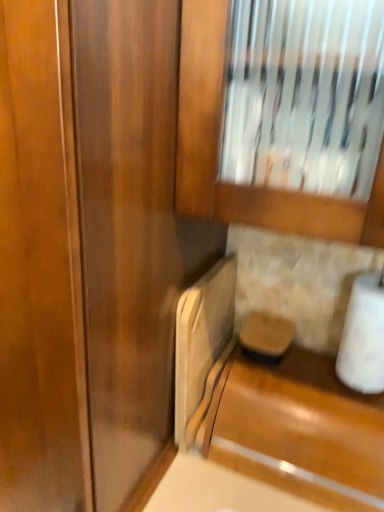
What do you see at coordinates (299, 430) in the screenshot? I see `glossy wood cabinet at lower right` at bounding box center [299, 430].

Find the location of a particular element. Image resolution: width=384 pixels, height=512 pixels. glossy wood cabinet at lower right is located at coordinates (299, 430).

In order to face white matte toilet paper at lower right, should I rotate leftwards or rightwards?

To align with it, rotate right about 22.948°.

This screenshot has height=512, width=384. What do you see at coordinates (363, 336) in the screenshot?
I see `white matte toilet paper at lower right` at bounding box center [363, 336].

The image size is (384, 512). In order to click on white matte toilet paper at lower right in this screenshot , I will do `click(363, 336)`.

Where is `glossy wood cabinet at lower right`? This screenshot has height=512, width=384. glossy wood cabinet at lower right is located at coordinates (299, 430).

Is glossy wood cabinet at lower right to the right of white matte toilet paper at lower right from the viewer's perspective?

No.

Is the depth of glossy wood cabinet at lower right greater than that of white matte toilet paper at lower right?

No, glossy wood cabinet at lower right is closer to the camera.

Considering the points (318, 444) and (364, 321), which point is in front, point (318, 444) or point (364, 321)?

Point (364, 321)

From the image's perspective, between glossy wood cabinet at lower right and white matte toilet paper at lower right, who is located below?

glossy wood cabinet at lower right is shown below in the image.

From a real-world perspective, relative to white matte toilet paper at lower right, is glossy wood cabinet at lower right vertically above or below?

glossy wood cabinet at lower right is situated lower than white matte toilet paper at lower right in the real world.

Is glossy wood cabinet at lower right wider than white matte toilet paper at lower right?

Correct, the width of glossy wood cabinet at lower right exceeds that of white matte toilet paper at lower right.

Between glossy wood cabinet at lower right and white matte toilet paper at lower right, which one has less height?

glossy wood cabinet at lower right is shorter.

Which of these two, glossy wood cabinet at lower right or white matte toilet paper at lower right, is bigger?

Bigger between the two is glossy wood cabinet at lower right.

Which is correct: glossy wood cabinet at lower right is inside white matte toilet paper at lower right, or outside of it?

glossy wood cabinet at lower right is spatially situated outside white matte toilet paper at lower right.

Are glossy wood cabinet at lower right and white matte toilet paper at lower right located far from each other?

They are positioned close to each other.

Is glossy wood cabinet at lower right aimed at white matte toilet paper at lower right?

No, glossy wood cabinet at lower right is not turned towards white matte toilet paper at lower right.

How different are the orientations of glossy wood cabinet at lower right and white matte toilet paper at lower right in degrees?

0.688 degrees.

How distant is glossy wood cabinet at lower right from white matte toilet paper at lower right?

glossy wood cabinet at lower right and white matte toilet paper at lower right are 6.44 inches apart from each other.

Find the location of a particular element. Image resolution: width=384 pixels, height=512 pixels. cabinetry on the left of the white matte toilet paper at lower right is located at coordinates (299, 430).

Between white matte toilet paper at lower right and glossy wood cabinet at lower right, which one appears on the right side from the viewer's perspective?

From the viewer's perspective, white matte toilet paper at lower right appears more on the right side.

Considering the positions of objects white matte toilet paper at lower right and glossy wood cabinet at lower right in the image provided, who is in front, white matte toilet paper at lower right or glossy wood cabinet at lower right?

glossy wood cabinet at lower right is closer to the camera.

Which is in front, point (354, 295) or point (227, 458)?

Positioned in front is point (354, 295).

From the image's perspective, is white matte toilet paper at lower right beneath glossy wood cabinet at lower right?

No, from the image's perspective, white matte toilet paper at lower right is not beneath glossy wood cabinet at lower right.

From a real-world perspective, which is physically above, white matte toilet paper at lower right or glossy wood cabinet at lower right?

white matte toilet paper at lower right is physically above.

Does white matte toilet paper at lower right have a greater width compared to glossy wood cabinet at lower right?

No.

Between white matte toilet paper at lower right and glossy wood cabinet at lower right, which one has more height?

white matte toilet paper at lower right.

Can you confirm if white matte toilet paper at lower right is bigger than glossy wood cabinet at lower right?

Incorrect, white matte toilet paper at lower right is not larger than glossy wood cabinet at lower right.

Do you think white matte toilet paper at lower right is within glossy wood cabinet at lower right, or outside of it?

white matte toilet paper at lower right cannot be found inside glossy wood cabinet at lower right.

Does white matte toilet paper at lower right touch glossy wood cabinet at lower right?

white matte toilet paper at lower right and glossy wood cabinet at lower right are clearly separated.

Is white matte toilet paper at lower right facing towards glossy wood cabinet at lower right?

No.

Locate an element on the screen. cabinetry in front of the white matte toilet paper at lower right is located at coordinates (299, 430).

Locate an element on the screen. Image resolution: width=384 pixels, height=512 pixels. toilet paper above the glossy wood cabinet at lower right (from the image's perspective) is located at coordinates (363, 336).

In order to click on cabinetry on the left of white matte toilet paper at lower right in this screenshot , I will do `click(299, 430)`.